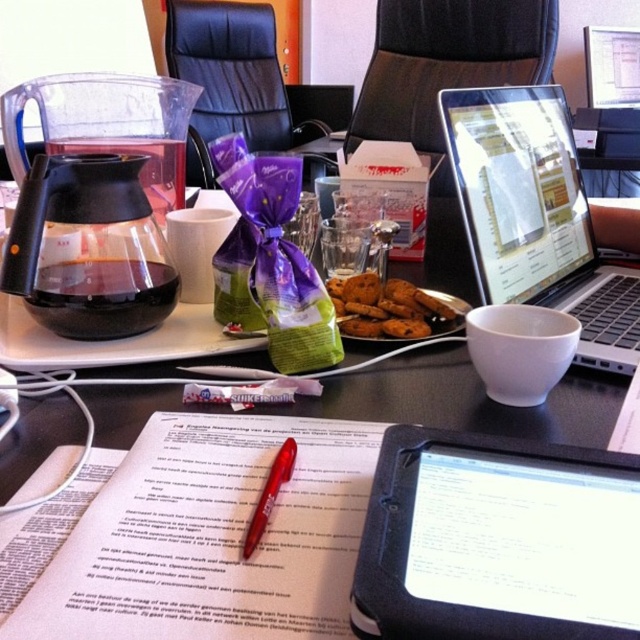
Question: Does white paper at center have a smaller size compared to black plastic table at center?

Choices:
 (A) yes
 (B) no

Answer: (A)

Question: Can you confirm if silver/black laptop at upper right is positioned to the right of chocolate chip cookies at center?

Choices:
 (A) yes
 (B) no

Answer: (A)

Question: Which point appears closest to the camera in this image?

Choices:
 (A) (582, 353)
 (B) (401, 292)
 (C) (252, 534)

Answer: (C)

Question: Which of the following is the closest to the observer?

Choices:
 (A) black plastic table at center
 (B) chocolate chip cookies at center
 (C) white paper at center
 (D) black plastic tablet at lower center

Answer: (D)

Question: Can you confirm if black plastic tablet at lower center is positioned to the left of chocolate chip cookies at center?

Choices:
 (A) yes
 (B) no

Answer: (B)

Question: Which point appears farthest from the camera in this image?

Choices:
 (A) (458, 122)
 (B) (436, 461)
 (C) (256, 449)
 (D) (426, 310)

Answer: (D)